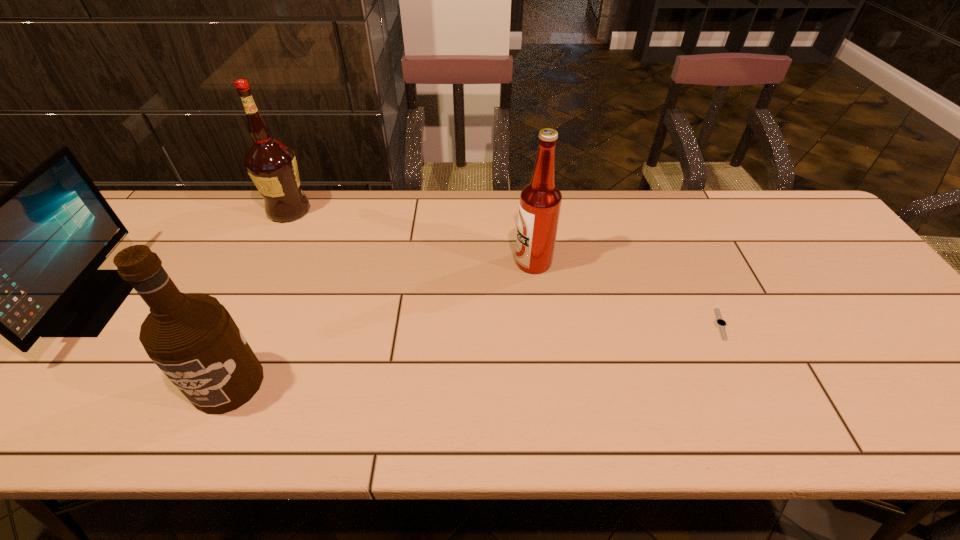
Where is `the farthest alcohol`? The image size is (960, 540). the farthest alcohol is located at coordinates (272, 166).

Locate an element on the screen. The width and height of the screenshot is (960, 540). the second nearest alcohol is located at coordinates (540, 202).

Where is `the rightmost alcohol`? Image resolution: width=960 pixels, height=540 pixels. the rightmost alcohol is located at coordinates (540, 202).

Where is `the nearest alcohol`? The height and width of the screenshot is (540, 960). the nearest alcohol is located at coordinates (192, 338).

Find the location of a particular element. The width and height of the screenshot is (960, 540). the leftmost object is located at coordinates (24, 264).

Where is `monitor`? The width and height of the screenshot is (960, 540). monitor is located at coordinates point(24,264).

Image resolution: width=960 pixels, height=540 pixels. Identify the location of watch. (721, 324).

The width and height of the screenshot is (960, 540). I want to click on the rightmost object, so click(721, 324).

Locate an element on the screen. blank space located on the label of the farthest object is located at coordinates (412, 210).

I want to click on vacant space located 0.150m on the label side of the second nearest alcohol, so click(x=461, y=262).